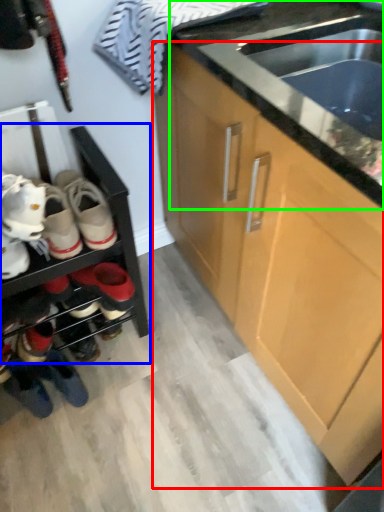
Question: Considering the real-world distances, which object is farthest from cabinetry (highlighted by a red box)? shelf (highlighted by a blue box) or countertop (highlighted by a green box)?

Choices:
 (A) shelf
 (B) countertop

Answer: (A)